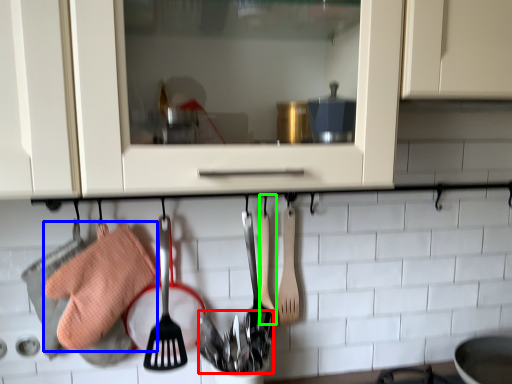
Question: Estimate the real-world distances between objects in this image. Which object is closer to silverware (highlighted by a red box), material (highlighted by a blue box) or spatula (highlighted by a green box)?

Choices:
 (A) material
 (B) spatula

Answer: (B)